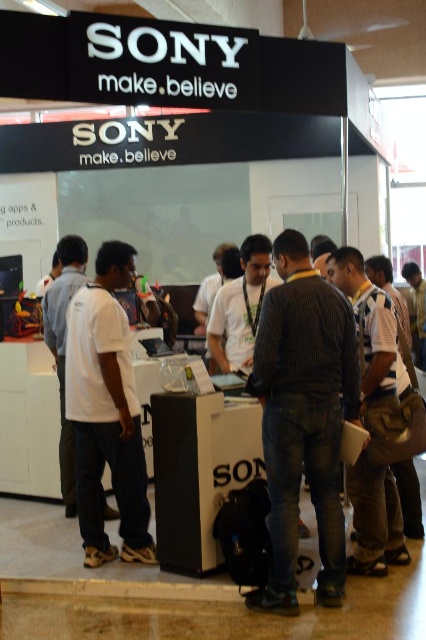
You are organizing a photo shoot at the Sony exhibition booth. You need to ensure that all attendees are visible in the group photo. Given the dark striped shirt at center and the white matte shirt at center, which shirt should you position closer to the camera to ensure visibility?

The dark striped shirt at center is larger in width than the white matte shirt at center, so positioning the dark striped shirt at center closer to the camera would help maintain visibility as it already has a more prominent size.

Consider the image. You are a photographer at the Sony booth. You need to take a group photo of the dark striped shirt at center and the white matte shirt at center. Which person should you ask to move back so that both appear in the frame equally?

The dark striped shirt at center is bigger than the white matte shirt at center, so you should ask the dark striped shirt at center to move back so that both appear in the frame equally.

You are a photographer at the Sony exhibition booth. You want to take a photo that includes both the dark striped shirt at center and the white matte shirt at center. The camera you have can focus on subjects within a 5 feet range. Will both shirts be in focus?

The distance between the dark striped shirt at center and the white matte shirt at center is 4.58 feet, which is within the 5 feet range. Therefore, both shirts will be in focus.